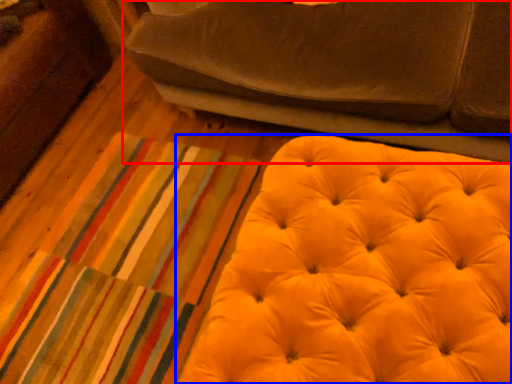
Question: Which object is closer to the camera taking this photo, studio couch (highlighted by a red box) or furniture (highlighted by a blue box)?

Choices:
 (A) studio couch
 (B) furniture

Answer: (B)